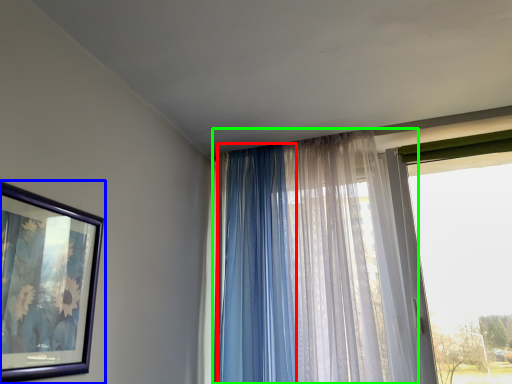
Question: Estimate the real-world distances between objects in this image. Which object is farther from curtain (highlighted by a red box), picture frame (highlighted by a blue box) or curtain (highlighted by a green box)?

Choices:
 (A) picture frame
 (B) curtain

Answer: (A)